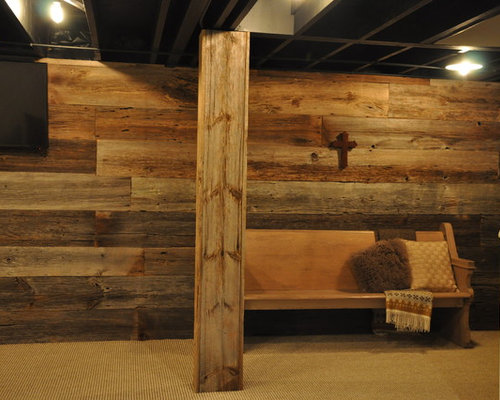
The height and width of the screenshot is (400, 500). Identify the location of carpeted floor. (315, 376).